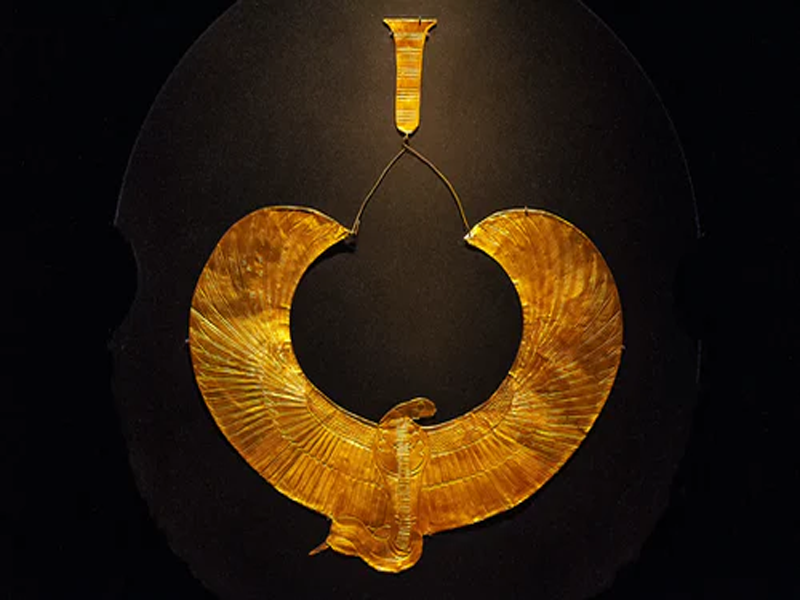
You are a GUI agent. You are given a task and a screenshot of the screen. Output one action in this format:
    pyautogui.click(x=<x>, y=<y>)
    Task: Click on the display
    This screenshot has height=600, width=800.
    Given the screenshot: What is the action you would take?
    pyautogui.click(x=689, y=345)